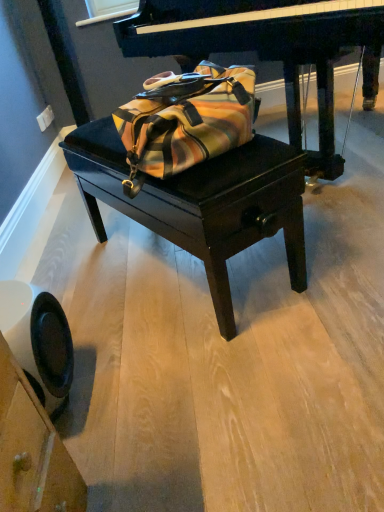
You are a GUI agent. You are given a task and a screenshot of the screen. Output one action in this format:
    pyautogui.click(x=<x>, y=<y>)
    Task: Click on the unoccupied region to the right of black plastic swivel chair at lower left
    
    Given the screenshot: What is the action you would take?
    pyautogui.click(x=127, y=390)